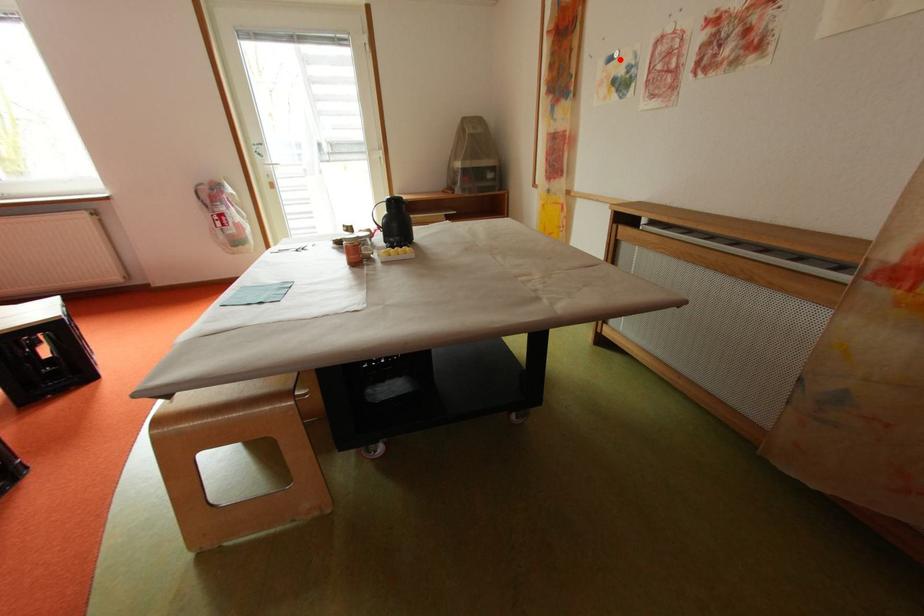
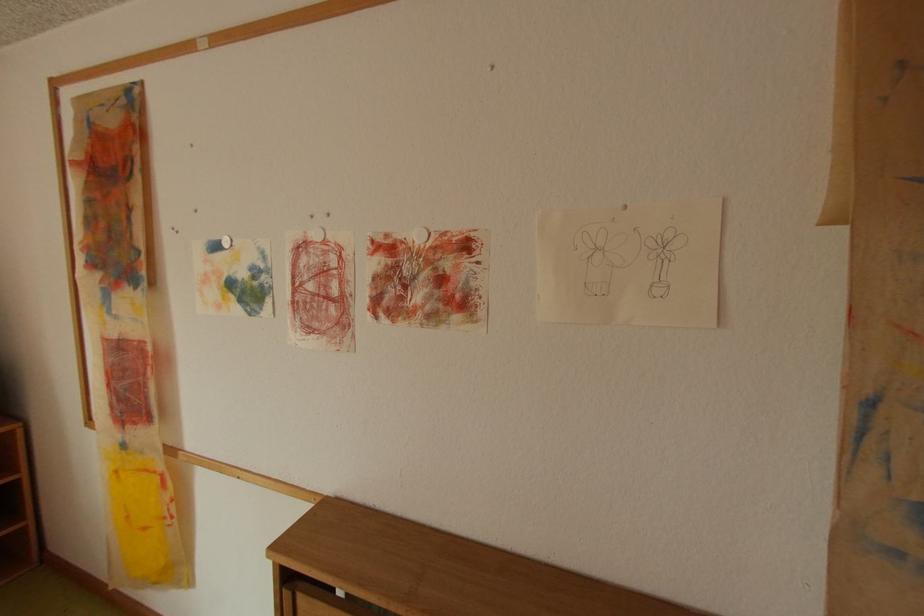
The point at the highlighted location is marked in the first image. Where is the corresponding point in the second image?

(225, 246)